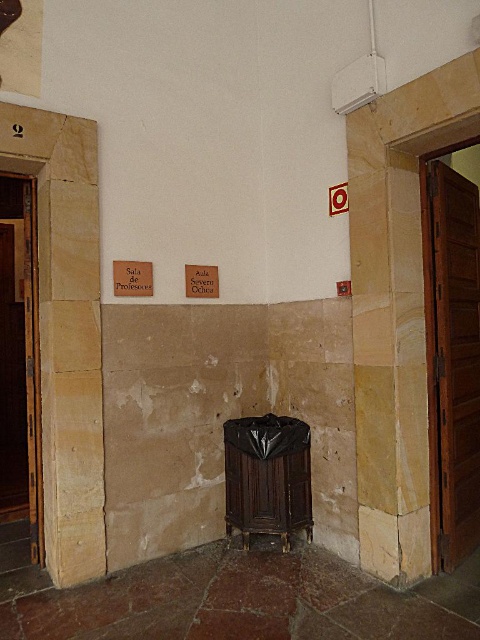
In the scene shown: You are a maintenance worker in a historic building. You need to replace the hinges on both the brown wooden door at right and the brown wooden door at left. Which door requires fewer hinges because of its size?

The brown wooden door at right requires fewer hinges because it is shorter than the brown wooden door at left.

You are standing in front of the wall with the two signs. There are two points marked on the wall at coordinates point (440, 228) and point (32, 266). Which point is closer to you?

Point (440, 228) is closer to the viewer than point (32, 266).